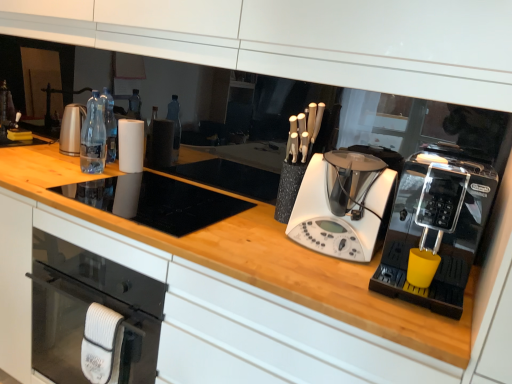
At what (x,y) coordinates should I click in order to perform the action: click on free point to the right of white matte paper towel at center. Please return your answer as a coordinate pair (x, y). This screenshot has width=512, height=384. Looking at the image, I should click on (161, 173).